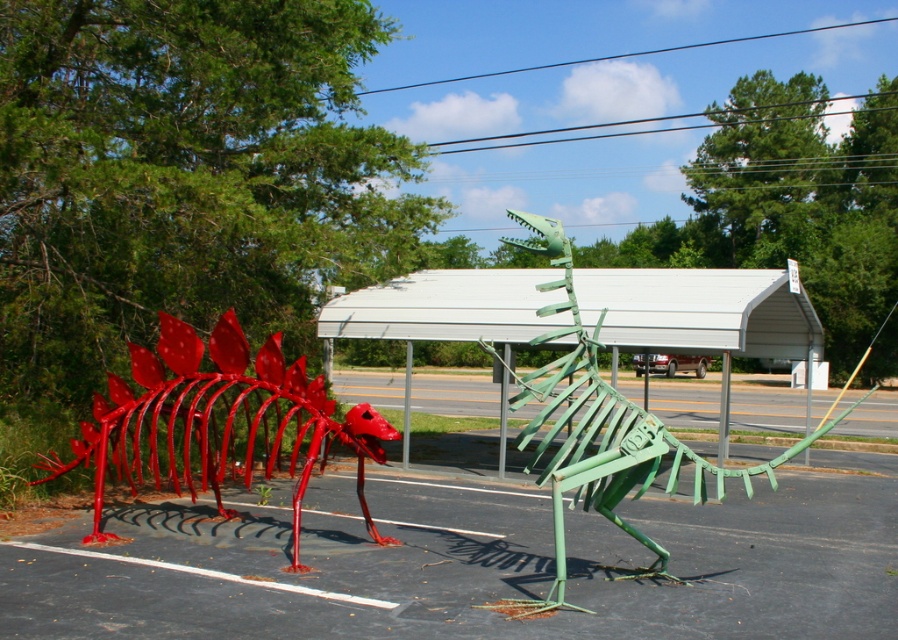
Question: Among these points, which one is nearest to the camera?

Choices:
 (A) (626, 445)
 (B) (359, 451)

Answer: (A)

Question: Is metallic red dinosaur at left above green metallic dinosaur at center?

Choices:
 (A) yes
 (B) no

Answer: (A)

Question: Can you confirm if metallic red dinosaur at left is bigger than green metallic dinosaur at center?

Choices:
 (A) no
 (B) yes

Answer: (A)

Question: In this image, where is metallic red dinosaur at left located relative to green metallic dinosaur at center?

Choices:
 (A) above
 (B) below

Answer: (A)